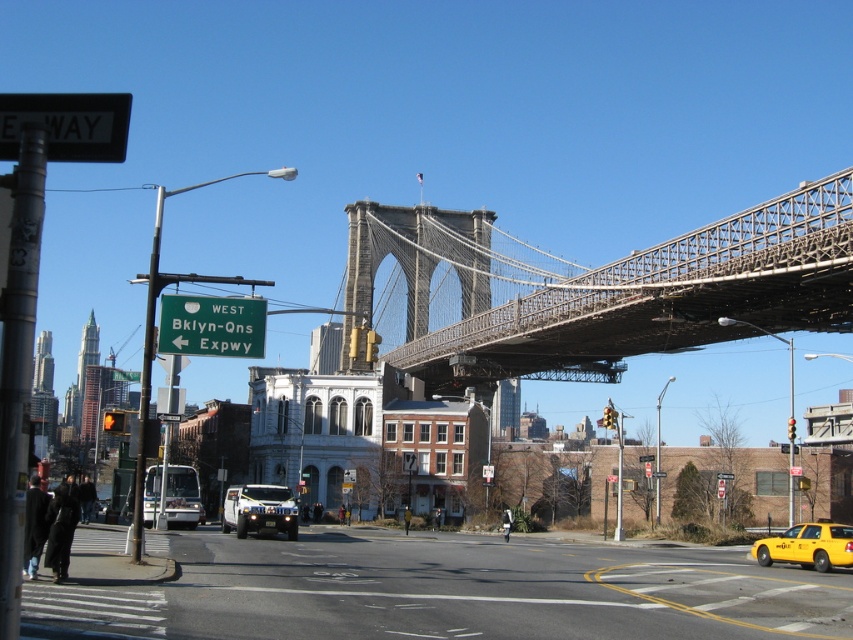
Find the location of `white plastic sign at upper left`. white plastic sign at upper left is located at coordinates (67, 124).

Can you confirm if white plastic sign at upper left is positioned above red glass traffic light at upper center?

Yes.

Measure the distance between point (103, 148) and camera.

Point (103, 148) is 27.37 meters from camera.

Image resolution: width=853 pixels, height=640 pixels. What are the coordinates of `white plastic sign at upper left` in the screenshot? It's located at (67, 124).

Does yellow matte taxi at lower right appear on the left side of red glass traffic light at upper center?

Yes, yellow matte taxi at lower right is to the left of red glass traffic light at upper center.

Is yellow matte taxi at lower right further to the viewer compared to red glass traffic light at upper center?

No, yellow matte taxi at lower right is closer to the viewer.

Does point (811, 556) come behind point (788, 433)?

No, it is not.

Identify the location of yellow matte taxi at lower right. (807, 547).

The width and height of the screenshot is (853, 640). What are the coordinates of `yellow matte taxi at lower right` in the screenshot? It's located at (807, 547).

Between point (840, 545) and point (228, 493), which one is positioned in front?

Positioned in front is point (840, 545).

Find the location of a particular element. This screenshot has width=853, height=640. yellow matte taxi at lower right is located at coordinates coord(807,547).